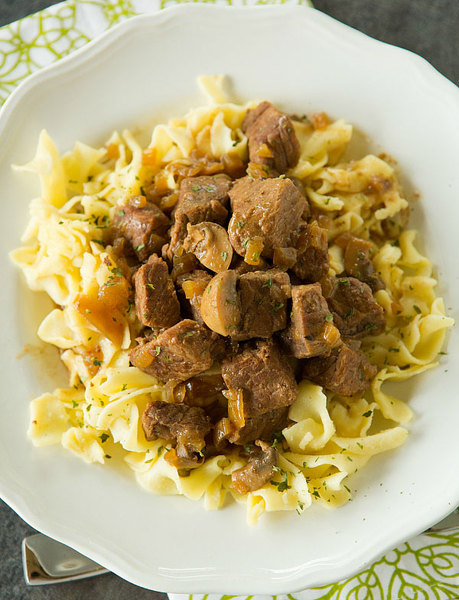
You are a GUI agent. You are given a task and a screenshot of the screen. Output one action in this format:
    pyautogui.click(x=<x>, y=<y>)
    Task: Click on the table
    The width and height of the screenshot is (459, 600).
    Given the screenshot: What is the action you would take?
    pyautogui.click(x=120, y=591)